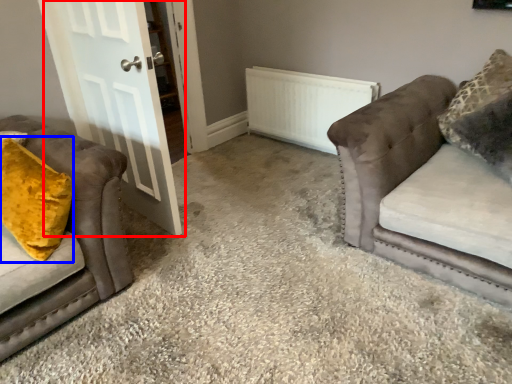
Question: Among these objects, which one is farthest to the camera, door (highlighted by a red box) or throw pillow (highlighted by a blue box)?

Choices:
 (A) door
 (B) throw pillow

Answer: (A)